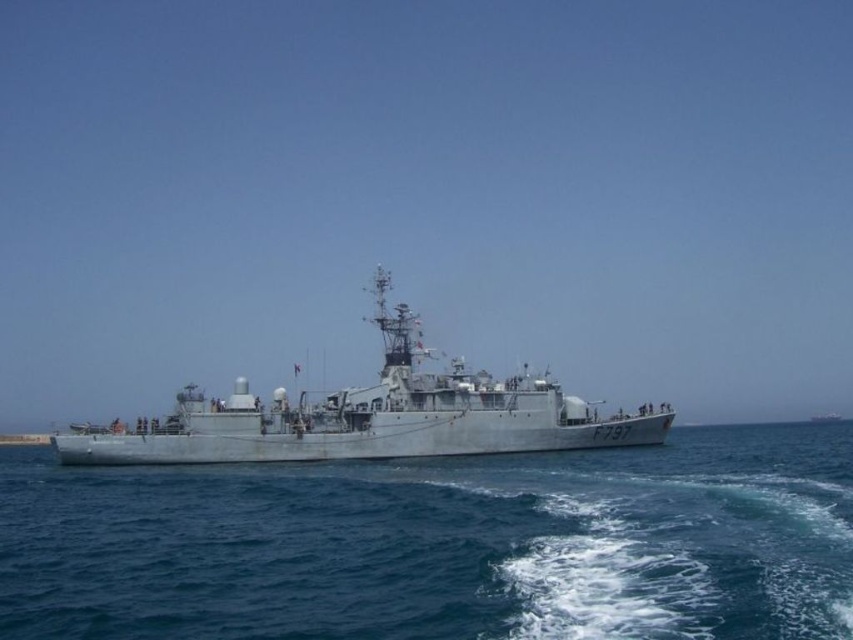
You are a drone operator controlling a drone that needs to land on a specific point on the naval ship. The point is labeled as point (538,600). The drone has a maximum landing distance of 150 feet. Based on the scene description, can the drone safely land on that point?

The distance of point (538,600) from the camera is 172.89 feet, which exceeds the drone maximum landing distance of 150 feet. Therefore, the drone cannot safely land on that point.

You are an observer on a nearby boat looking at the gray metallic ship at center. Which direction should you look to see the blue water at center?

The blue water at center is to the right of the gray metallic ship at center, so you should look to the right of the gray metallic ship at center to see the blue water at center.

You are a drone operator controlling a drone that has a maximum flight range of 15 meters. You need to fly the drone from the blue water at center to the gray metallic ship at center. Can the drone reach the ship?

The blue water at center and gray metallic ship at center are 17.05 meters apart. Since the drone has a maximum flight range of 15 meters, it cannot reach the ship.